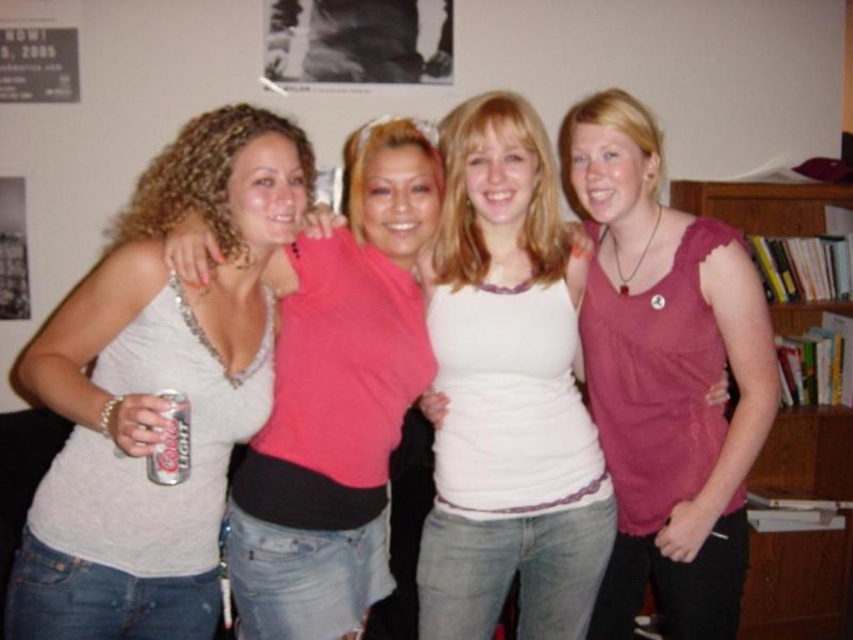
Between white matte tank top at left and wooden bookshelf at right, which one is positioned higher?

Positioned higher is white matte tank top at left.

Can you confirm if white matte tank top at left is bigger than wooden bookshelf at right?

Yes, white matte tank top at left is bigger than wooden bookshelf at right.

This screenshot has width=853, height=640. What do you see at coordinates (155, 388) in the screenshot? I see `white matte tank top at left` at bounding box center [155, 388].

I want to click on white matte tank top at left, so click(x=155, y=388).

Is white matte tank top at center bigger than wooden bookshelf at right?

Yes, white matte tank top at center is bigger than wooden bookshelf at right.

Is point (489, 524) less distant than point (811, 577)?

Yes, it is in front of point (811, 577).

Between point (498, 435) and point (761, 630), which one is positioned in front?

Point (498, 435)

The height and width of the screenshot is (640, 853). What are the coordinates of `white matte tank top at center` in the screenshot? It's located at (508, 390).

Who is positioned more to the right, pink fabric tank top at center or silver metallic can at lower left?

pink fabric tank top at center is more to the right.

Describe the element at coordinates (665, 376) in the screenshot. The height and width of the screenshot is (640, 853). I see `pink fabric tank top at center` at that location.

Where is `pink fabric tank top at center`? This screenshot has width=853, height=640. pink fabric tank top at center is located at coordinates (665, 376).